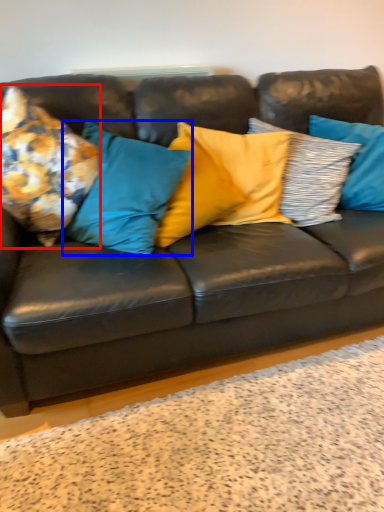
Question: Which of the following is the farthest to the observer, pillow (highlighted by a red box) or pillow (highlighted by a blue box)?

Choices:
 (A) pillow
 (B) pillow

Answer: (B)